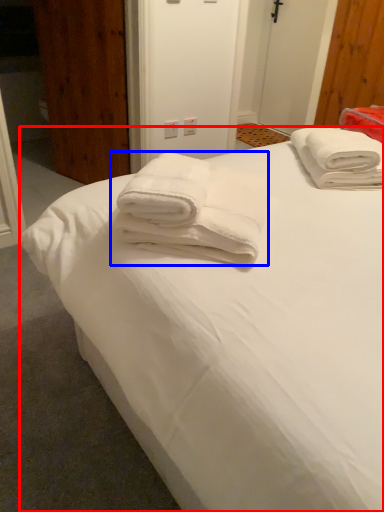
Question: Which object is further to the camera taking this photo, bed (highlighted by a red box) or towel (highlighted by a blue box)?

Choices:
 (A) bed
 (B) towel

Answer: (B)